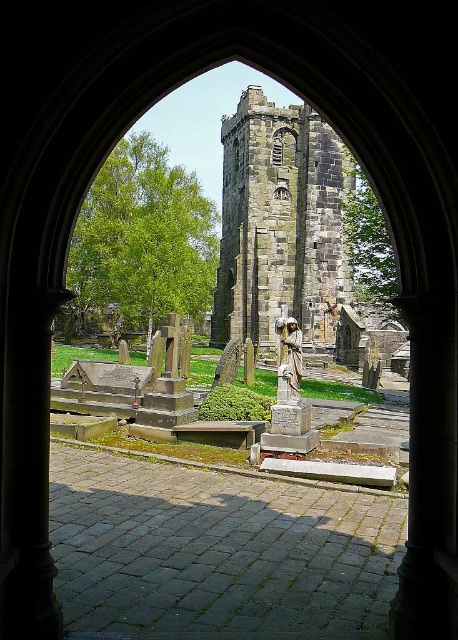
Question: Among these objects, which one is nearest to the camera?

Choices:
 (A) stone tower at center
 (B) polished bronze statue at center

Answer: (B)

Question: Can you confirm if stone tower at center is smaller than polished bronze statue at center?

Choices:
 (A) yes
 (B) no

Answer: (B)

Question: Does stone tower at center appear over polished bronze statue at center?

Choices:
 (A) yes
 (B) no

Answer: (A)

Question: Considering the relative positions of stone tower at center and polished bronze statue at center in the image provided, where is stone tower at center located with respect to polished bronze statue at center?

Choices:
 (A) right
 (B) left

Answer: (B)

Question: Which point appears closest to the camera in this image?

Choices:
 (A) (289, 394)
 (B) (223, 237)

Answer: (A)

Question: Which point is farther from the camera taking this photo?

Choices:
 (A) (267, 193)
 (B) (279, 358)

Answer: (A)